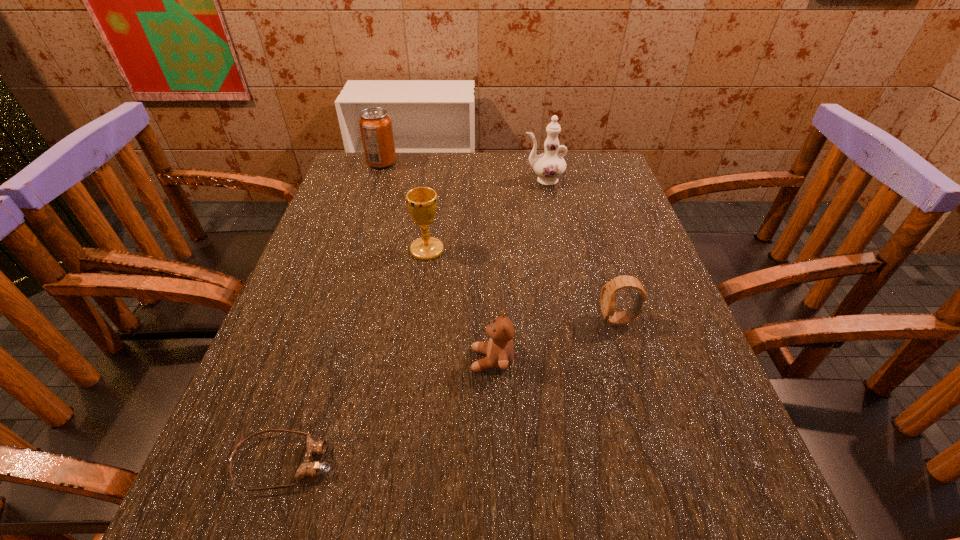
This screenshot has width=960, height=540. In order to click on chinaware in this screenshot , I will do `click(550, 165)`.

This screenshot has width=960, height=540. In order to click on the second farthest object in this screenshot , I will do `click(550, 165)`.

Image resolution: width=960 pixels, height=540 pixels. I want to click on soda can, so click(x=375, y=124).

Where is `chalice`? This screenshot has height=540, width=960. chalice is located at coordinates (422, 201).

Locate an element on the screen. The height and width of the screenshot is (540, 960). the third object from left to right is located at coordinates (422, 201).

This screenshot has width=960, height=540. Identify the location of teddy bear. (499, 351).

The width and height of the screenshot is (960, 540). In order to click on the third object from right to left in this screenshot , I will do `click(499, 351)`.

The image size is (960, 540). Find the location of `the third nearest object`. the third nearest object is located at coordinates (607, 298).

Identify the location of the nearest object. The image size is (960, 540). (308, 468).

Find the location of `the shortest object`. the shortest object is located at coordinates (308, 468).